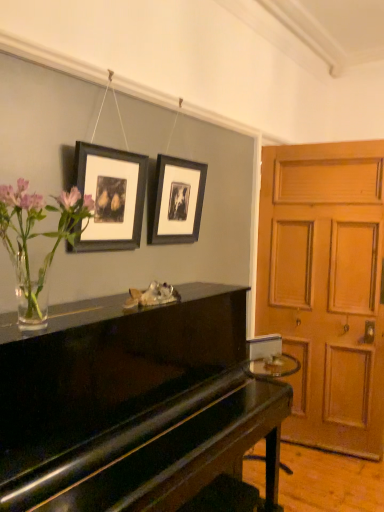
Question: Relative to wooden door at right, is black matte picture frame at upper center, arranged as the 1th picture frame when viewed from the right, in front or behind?

Choices:
 (A) behind
 (B) front

Answer: (B)

Question: From the image's perspective, is black matte picture frame at upper center, the first picture frame in the back-to-front sequence, located above or below wooden door at right?

Choices:
 (A) below
 (B) above

Answer: (B)

Question: Based on their relative distances, which object is nearer to the clear glass vase with flowers at left?

Choices:
 (A) black matte picture frame at upper center, which appears as the 2th picture frame when viewed from the left
 (B) glossy black piano at center
 (C) wooden door at right
 (D) matte black picture frame at upper center, positioned as the second picture frame in right-to-left order

Answer: (D)

Question: Considering the real-world distances, which object is closest to the glossy black piano at center?

Choices:
 (A) clear glass vase with flowers at left
 (B) wooden door at right
 (C) black matte picture frame at upper center, the first picture frame in the back-to-front sequence
 (D) matte black picture frame at upper center, positioned as the second picture frame in right-to-left order

Answer: (A)